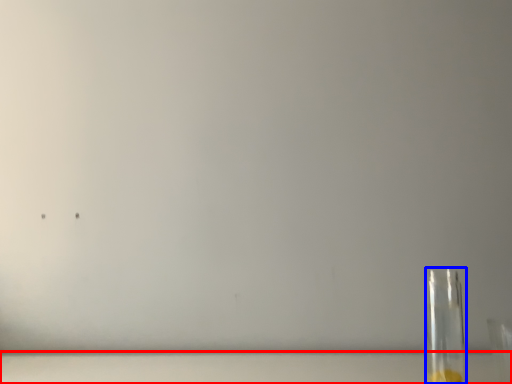
Question: Which of the following is the farthest to the observer, table top (highlighted by a red box) or bottle (highlighted by a blue box)?

Choices:
 (A) table top
 (B) bottle

Answer: (A)